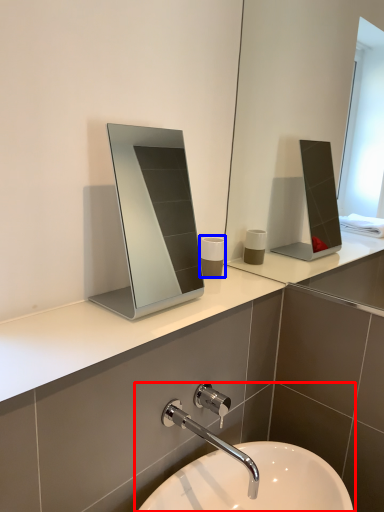
Question: Among these objects, which one is nearest to the camera, sink (highlighted by a red box) or toiletry (highlighted by a blue box)?

Choices:
 (A) sink
 (B) toiletry

Answer: (A)